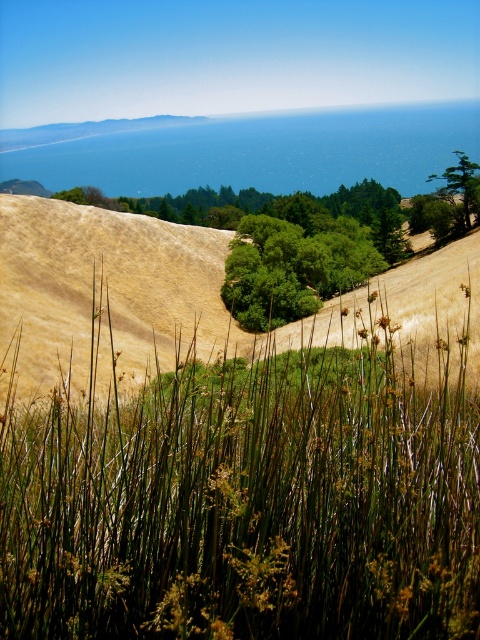
Is dry grass at center to the right of green leafy tree at upper center from the viewer's perspective?

No, dry grass at center is not to the right of green leafy tree at upper center.

Who is more distant from viewer, (56, 266) or (464, 211)?

Point (464, 211)

Locate an element on the screen. This screenshot has height=640, width=480. dry grass at center is located at coordinates (190, 298).

Where is `blue water at upper center`? The width and height of the screenshot is (480, 640). blue water at upper center is located at coordinates (259, 150).

You are a GUI agent. You are given a task and a screenshot of the screen. Output one action in this format:
    pyautogui.click(x=<x>, y=<y>)
    Task: Click on the blue water at upper center
    
    Given the screenshot: What is the action you would take?
    pyautogui.click(x=259, y=150)

Is dry grass at center bigger than blue water at upper center?

Incorrect, dry grass at center is not larger than blue water at upper center.

The image size is (480, 640). What do you see at coordinates (190, 298) in the screenshot?
I see `dry grass at center` at bounding box center [190, 298].

Image resolution: width=480 pixels, height=640 pixels. Describe the element at coordinates (190, 298) in the screenshot. I see `dry grass at center` at that location.

Identify the location of dry grass at center. The image size is (480, 640). (190, 298).